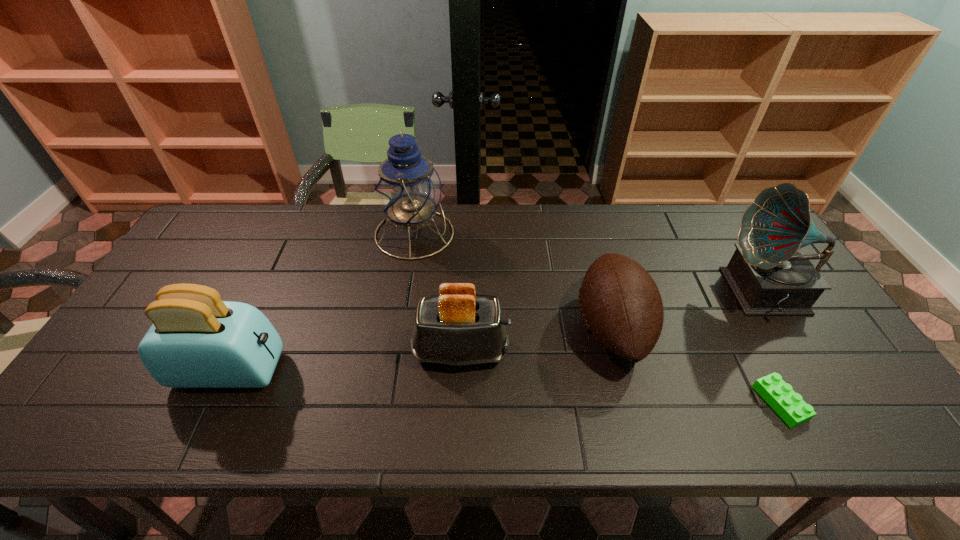
I want to click on free space located 0.080m on the horn of the record player, so click(695, 294).

At what (x,y) coordinates should I click in order to perform the action: click on free region located 0.390m on the horn of the record player. Please return your answer as a coordinate pair (x, y). The width and height of the screenshot is (960, 540). Looking at the image, I should click on (586, 294).

At what (x,y) coordinates should I click in order to perform the action: click on vacant space located on the side of the leftmost object with the lever. Please return your answer as a coordinate pair (x, y). Image resolution: width=960 pixels, height=540 pixels. Looking at the image, I should click on (333, 370).

Where is `free spot located 0.330m on the side of the right toaster with the control lever`? The image size is (960, 540). free spot located 0.330m on the side of the right toaster with the control lever is located at coordinates (640, 351).

Image resolution: width=960 pixels, height=540 pixels. In order to click on vacant region located 0.120m on the laces of the football in this screenshot , I will do `click(530, 328)`.

The image size is (960, 540). I want to click on free space located 0.060m on the laces of the football, so click(553, 328).

Identify the location of free space located on the laces of the football. The image size is (960, 540). (458, 328).

What are the coordinates of `vacant space located on the right of the shortest object` in the screenshot? It's located at (871, 403).

Identify the location of object that is at the far edge. The image size is (960, 540). (408, 189).

Where is `object that is at the near edge`? The height and width of the screenshot is (540, 960). object that is at the near edge is located at coordinates (779, 395).